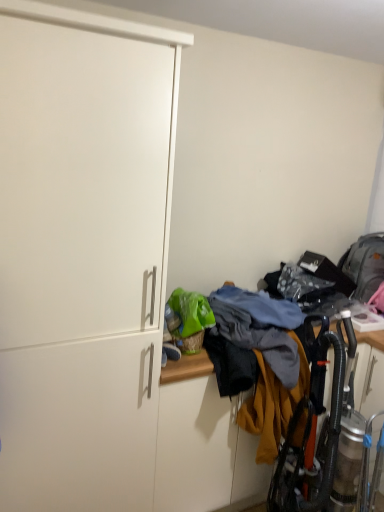
Question: From a real-world perspective, does white matte cabinet at left sit lower than multicolored fabric at lower right?

Choices:
 (A) no
 (B) yes

Answer: (A)

Question: Can you confirm if white matte cabinet at left is positioned to the right of multicolored fabric at lower right?

Choices:
 (A) yes
 (B) no

Answer: (B)

Question: Is white matte cabinet at left taller than multicolored fabric at lower right?

Choices:
 (A) yes
 (B) no

Answer: (A)

Question: Is white matte cabinet at left looking in the opposite direction of multicolored fabric at lower right?

Choices:
 (A) yes
 (B) no

Answer: (B)

Question: From the image's perspective, does white matte cabinet at left appear lower than multicolored fabric at lower right?

Choices:
 (A) no
 (B) yes

Answer: (A)

Question: Considering the relative positions of white matte cabinet at left and multicolored fabric at lower right in the image provided, is white matte cabinet at left behind multicolored fabric at lower right?

Choices:
 (A) no
 (B) yes

Answer: (A)

Question: Is multicolored fabric at lower right shorter than white matte cabinet at left?

Choices:
 (A) no
 (B) yes

Answer: (B)

Question: Considering the relative sizes of multicolored fabric at lower right and white matte cabinet at left in the image provided, is multicolored fabric at lower right wider than white matte cabinet at left?

Choices:
 (A) no
 (B) yes

Answer: (B)

Question: Considering the relative sizes of multicolored fabric at lower right and white matte cabinet at left in the image provided, is multicolored fabric at lower right smaller than white matte cabinet at left?

Choices:
 (A) yes
 (B) no

Answer: (A)

Question: From a real-world perspective, is multicolored fabric at lower right positioned over white matte cabinet at left based on gravity?

Choices:
 (A) no
 (B) yes

Answer: (A)

Question: Is multicolored fabric at lower right behind white matte cabinet at left?

Choices:
 (A) yes
 (B) no

Answer: (A)

Question: Is multicolored fabric at lower right closer to the viewer compared to white matte cabinet at left?

Choices:
 (A) yes
 (B) no

Answer: (B)

Question: In terms of size, does white matte cabinet at left appear bigger or smaller than multicolored fabric at lower right?

Choices:
 (A) big
 (B) small

Answer: (A)